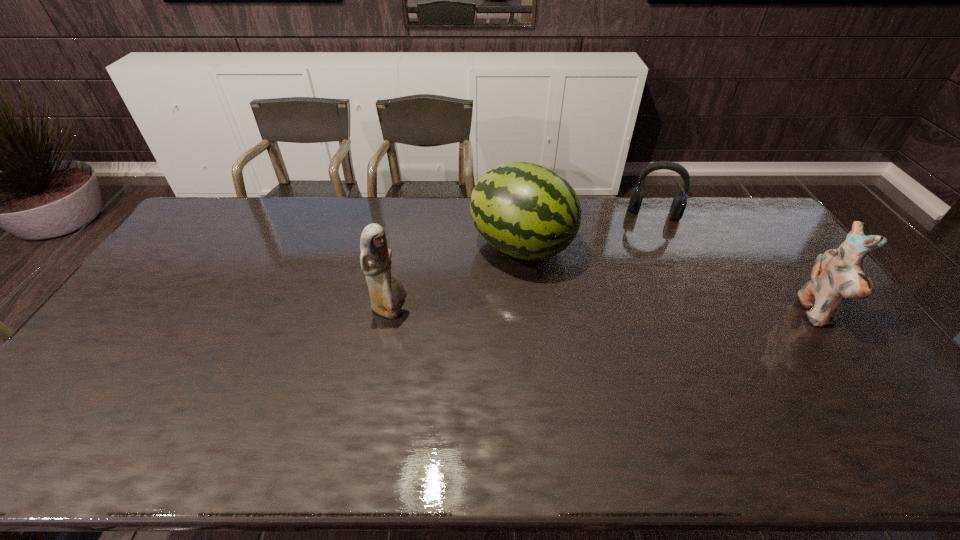
You are a GUI agent. You are given a task and a screenshot of the screen. Output one action in this format:
    pyautogui.click(x=<x>, y=<y>)
    Task: Click on the left figurine
    
    Given the screenshot: What is the action you would take?
    pyautogui.click(x=387, y=294)

Where is `the rightmost object`? The height and width of the screenshot is (540, 960). the rightmost object is located at coordinates tap(837, 274).

Image resolution: width=960 pixels, height=540 pixels. I want to click on the third object from left to right, so click(679, 203).

The image size is (960, 540). What are the coordinates of `headset` in the screenshot? It's located at (679, 203).

The width and height of the screenshot is (960, 540). Identify the location of watermelon. (529, 212).

Identify the location of vacant space located on the front-facing side of the left figurine. The image size is (960, 540). (539, 312).

In order to click on vacant region located on the headband of the headset in this screenshot , I will do `click(643, 288)`.

The image size is (960, 540). Find the location of `vacant space situated 0.100m on the headband of the headset`. vacant space situated 0.100m on the headband of the headset is located at coordinates (648, 240).

You are a GUI agent. You are given a task and a screenshot of the screen. Output one action in this format:
    pyautogui.click(x=<x>, y=<y>)
    Task: Click on the free point located 0.070m on the headband of the headset
    This screenshot has height=540, width=960.
    Given the screenshot: What is the action you would take?
    pyautogui.click(x=649, y=235)

Locate an element on the screen. free location located at the stem end of the watermelon is located at coordinates (621, 291).